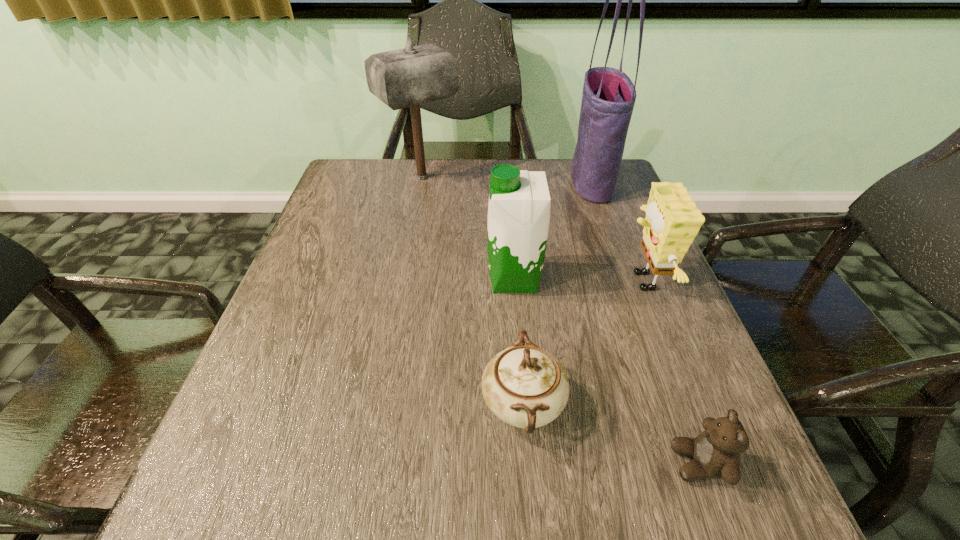
Image resolution: width=960 pixels, height=540 pixels. Find the location of `free space located 0.080m on the front-facing side of the fourth shortest object`. free space located 0.080m on the front-facing side of the fourth shortest object is located at coordinates (450, 279).

Where is `free space located 0.390m on the front-facing side of the fourth shortest object`? This screenshot has height=540, width=960. free space located 0.390m on the front-facing side of the fourth shortest object is located at coordinates (310, 279).

Identify the location of free location located on the front-facing side of the third shortest object. The width and height of the screenshot is (960, 540). (483, 281).

Locate an element on the screen. free region located on the front-facing side of the third shortest object is located at coordinates (460, 281).

Locate an element on the screen. vacant space situated 0.230m on the front-facing side of the third shortest object is located at coordinates 515,281.

I want to click on free space located on the right of the chinaware, so click(717, 405).

Locate an element on the screen. The height and width of the screenshot is (540, 960). free space located 0.160m on the face of the shortest object is located at coordinates (568, 463).

Locate an element on the screen. Image resolution: width=960 pixels, height=540 pixels. free space located on the face of the shortest object is located at coordinates (470, 463).

At what (x,y) coordinates should I click in order to perform the action: click on vacant space positioned on the face of the shortest object. Please return your answer as a coordinate pair (x, y). Looking at the image, I should click on (608, 463).

This screenshot has width=960, height=540. Find the location of `tote bag that is at the far edge`. tote bag that is at the far edge is located at coordinates (608, 99).